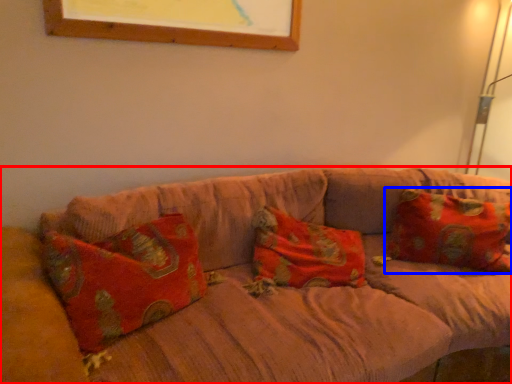
Question: Among these objects, which one is nearest to the camera, studio couch (highlighted by a red box) or pillow (highlighted by a blue box)?

Choices:
 (A) studio couch
 (B) pillow

Answer: (A)